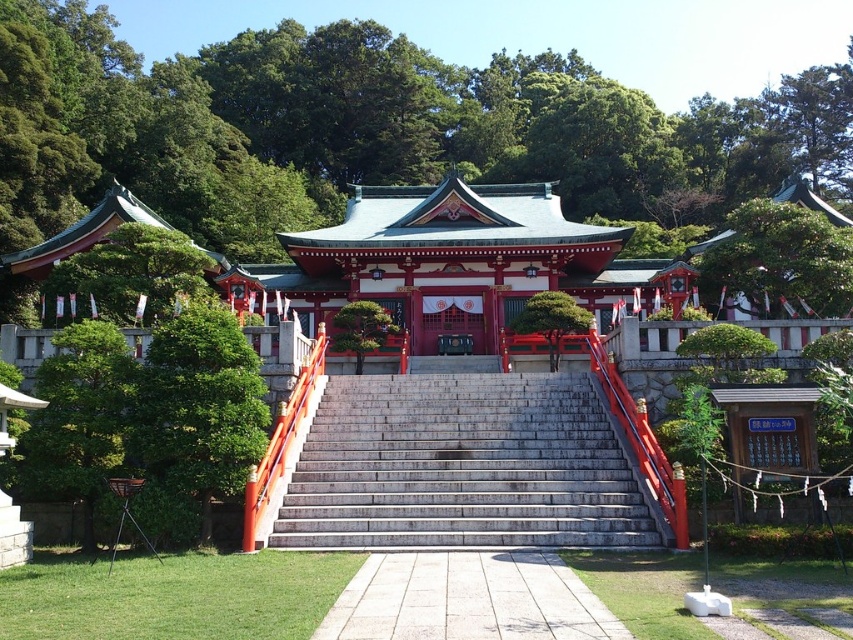
Question: Is the position of green leafy tree at left less distant than that of green glossy tree at center?

Choices:
 (A) no
 (B) yes

Answer: (B)

Question: Based on their relative distances, which object is nearer to the green leafy tree at left?

Choices:
 (A) green leafy tree at center
 (B) gray stone stairs at center
 (C) green leafy tree at upper center
 (D) green glossy tree at center

Answer: (A)

Question: Which of the following is the farthest from the observer?

Choices:
 (A) (134, 291)
 (B) (576, 372)

Answer: (B)

Question: Which point is farther from the camera taking this photo?

Choices:
 (A) (111, 316)
 (B) (163, 465)

Answer: (A)

Question: Can you confirm if green leafy tree at left is positioned below green glossy tree at center?

Choices:
 (A) yes
 (B) no

Answer: (B)

Question: Where is green leafy tree at upper center located in relation to green glossy tree at center in the image?

Choices:
 (A) right
 (B) left

Answer: (A)